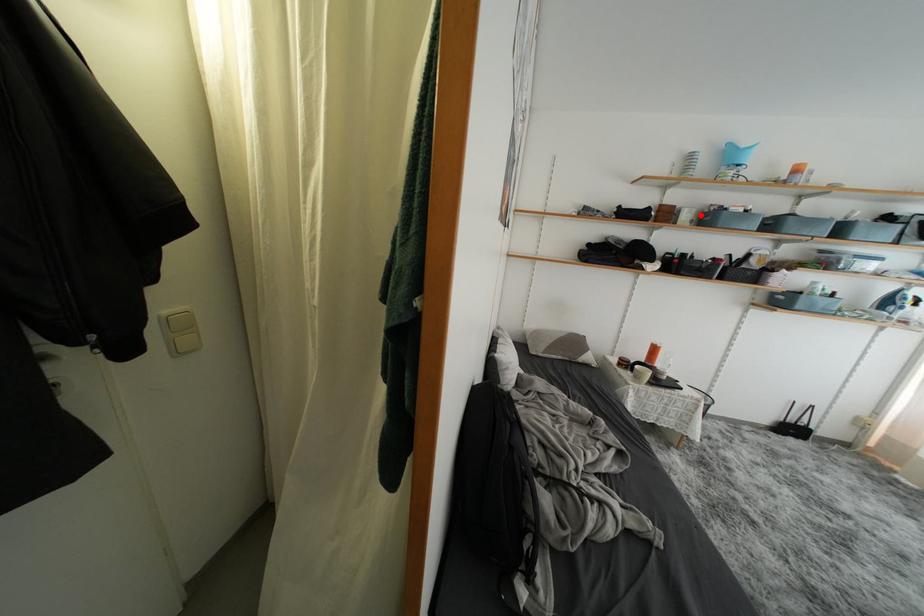
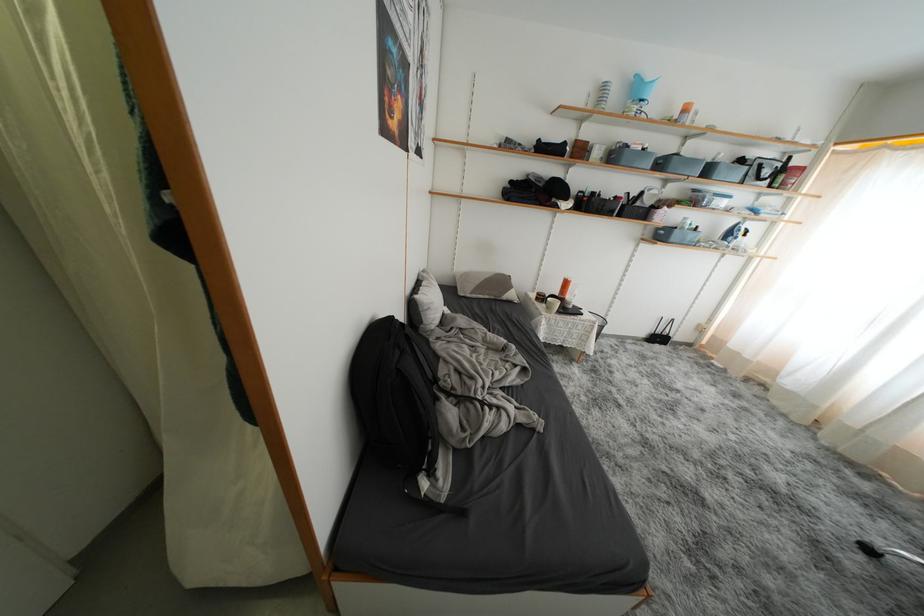
Find the pixel in the second image that matches the highlighted location in the first image.

(610, 152)